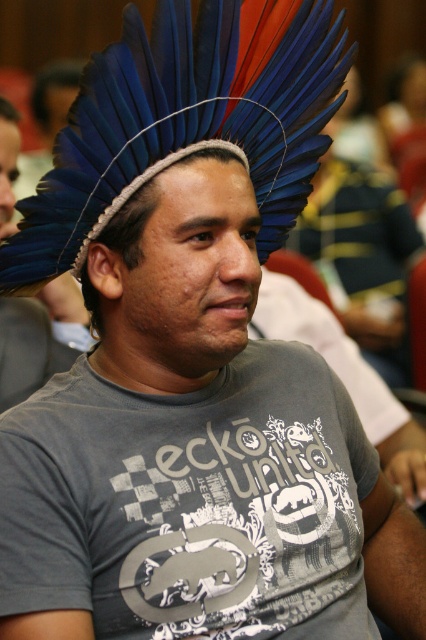
Question: Among these objects, which one is farthest from the camera?

Choices:
 (A) blue feathered headdress at center
 (B) gray printed t-shirt at center
 (C) blue feather headdress at upper center
 (D) blue feathered headdress at upper center

Answer: (D)

Question: Is blue feathered headdress at center further to camera compared to blue feathered headdress at upper center?

Choices:
 (A) no
 (B) yes

Answer: (A)

Question: Which point is farther from the camera taking this photo?

Choices:
 (A) (11, 196)
 (B) (77, 273)
 (C) (54, 300)
 (D) (109, 632)

Answer: (C)

Question: Based on their relative distances, which object is nearer to the blue feathered headdress at upper center?

Choices:
 (A) blue feather headdress at upper center
 (B) gray printed t-shirt at center

Answer: (A)

Question: Does gray printed t-shirt at center have a larger size compared to blue feathered headdress at center?

Choices:
 (A) no
 (B) yes

Answer: (B)

Question: Is gray printed t-shirt at center below blue feather headdress at upper center?

Choices:
 (A) yes
 (B) no

Answer: (A)